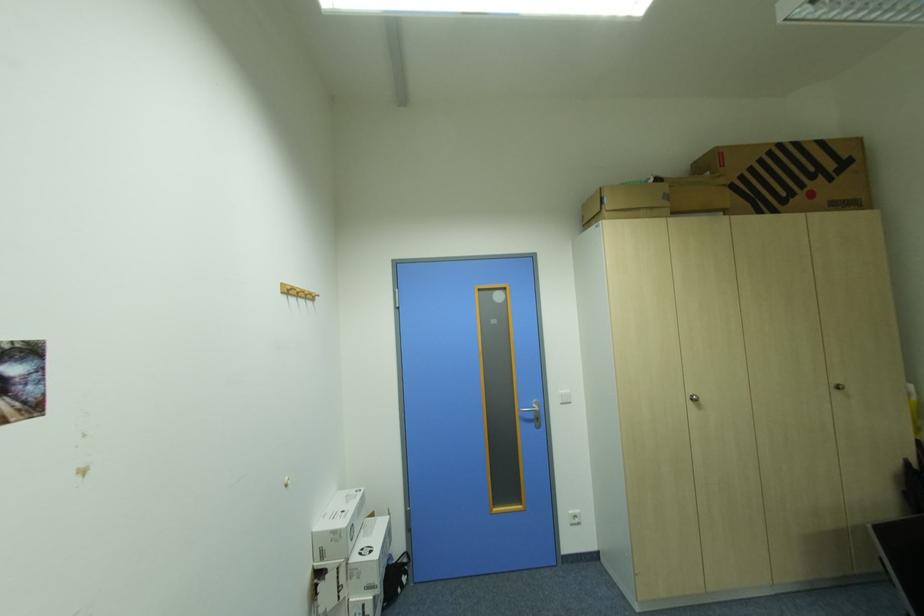
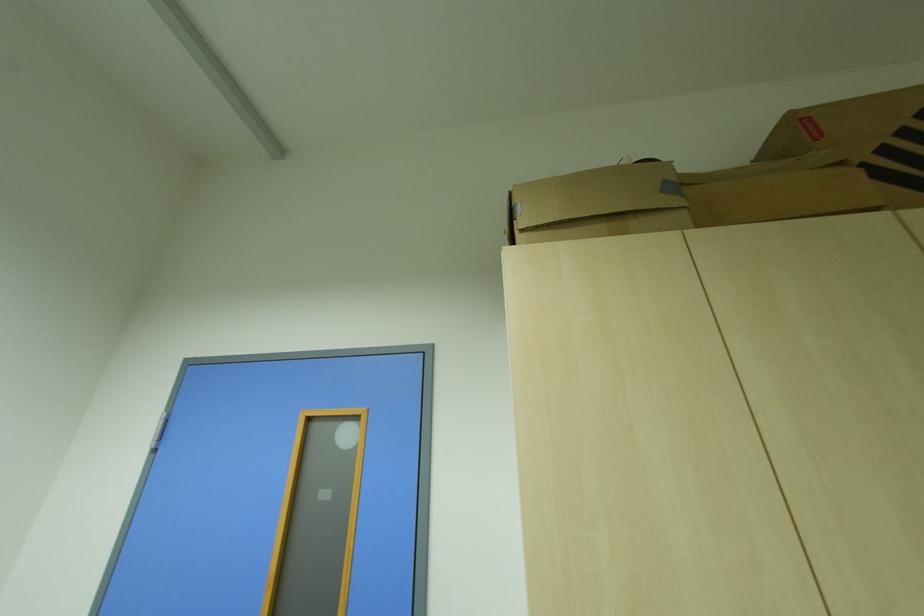
Which direction would the cameraman need to move to produce the second image?

The cameraman walked toward right, forward.